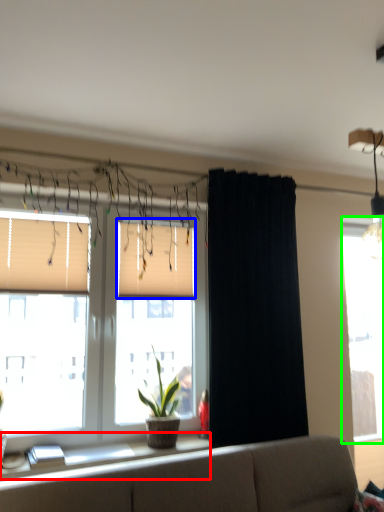
Question: Which object is positioned farthest from window sill (highlighted by a red box)? Select from window blind (highlighted by a blue box) and window (highlighted by a green box).

Choices:
 (A) window blind
 (B) window

Answer: (B)